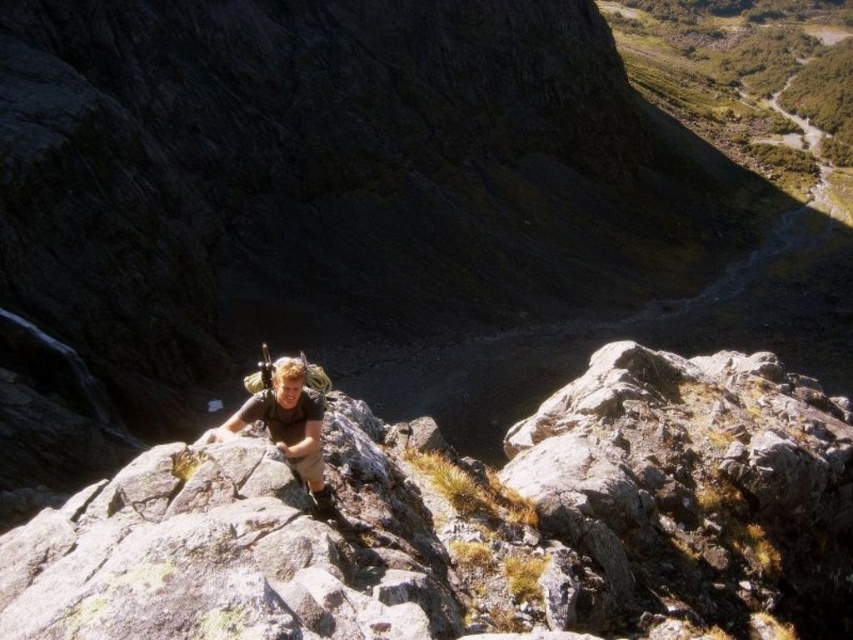
Which is more to the left, gray rock at center or matte brown shirt at center?

matte brown shirt at center is more to the left.

Who is taller, gray rock at center or matte brown shirt at center?

With more height is gray rock at center.

Does point (494, 547) lie behind point (318, 438)?

Yes.

Locate an element on the screen. gray rock at center is located at coordinates (473, 522).